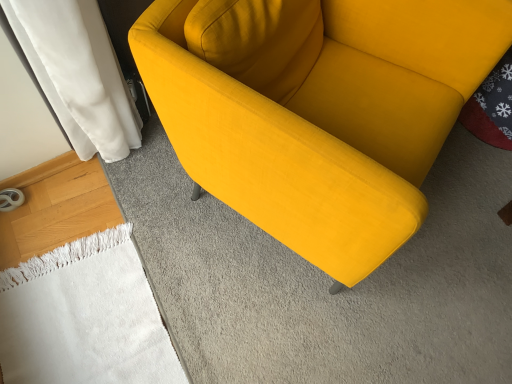
Question: In terms of width, does velvet yellow couch at center look wider or thinner when compared to white soft towel at lower left?

Choices:
 (A) thin
 (B) wide

Answer: (B)

Question: Considering the positions of point (343, 231) and point (69, 284), is point (343, 231) closer or farther from the camera than point (69, 284)?

Choices:
 (A) closer
 (B) farther

Answer: (A)

Question: Relative to white soft towel at lower left, is velvet yellow couch at center in front or behind?

Choices:
 (A) behind
 (B) front

Answer: (B)

Question: Is point (94, 339) positioned closer to the camera than point (411, 94)?

Choices:
 (A) farther
 (B) closer

Answer: (A)

Question: From the image's perspective, is white soft towel at lower left positioned above or below velvet yellow couch at center?

Choices:
 (A) above
 (B) below

Answer: (B)

Question: Considering the positions of white soft towel at lower left and velvet yellow couch at center in the image, is white soft towel at lower left wider or thinner than velvet yellow couch at center?

Choices:
 (A) wide
 (B) thin

Answer: (B)

Question: Is white soft towel at lower left to the left or to the right of velvet yellow couch at center in the image?

Choices:
 (A) left
 (B) right

Answer: (A)